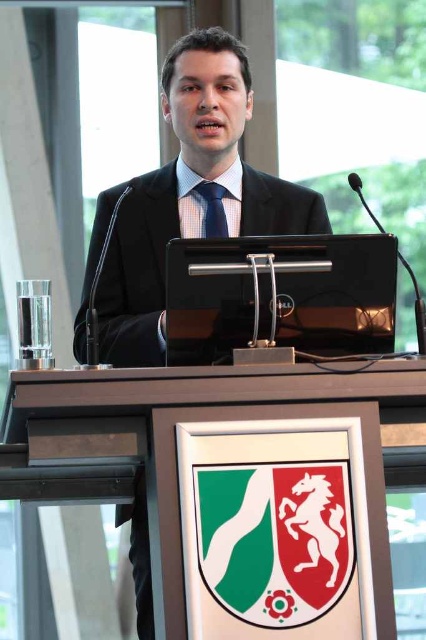
Question: Does wooden podium at center appear on the left side of blue textured tie at center?

Choices:
 (A) no
 (B) yes

Answer: (A)

Question: Among these points, which one is farthest from the camera?

Choices:
 (A) (218, 195)
 (B) (287, 454)

Answer: (A)

Question: Is black suit at center to the right of blue textured tie at center from the viewer's perspective?

Choices:
 (A) yes
 (B) no

Answer: (A)

Question: Observing the image, what is the correct spatial positioning of wooden podium at center in reference to black suit at center?

Choices:
 (A) below
 (B) above

Answer: (A)

Question: Which is nearer to the black suit at center?

Choices:
 (A) wooden podium at center
 (B) blue textured tie at center

Answer: (B)

Question: Which of the following is the farthest from the observer?

Choices:
 (A) (161, 253)
 (B) (255, 476)

Answer: (A)